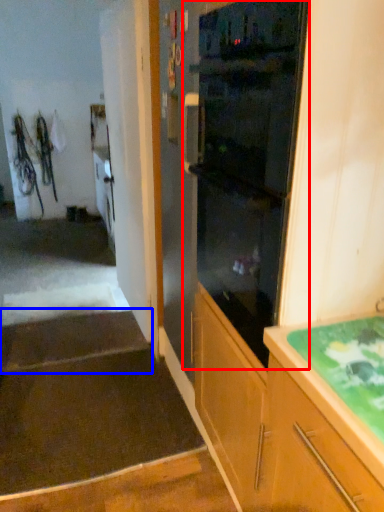
Question: Which of the following is the farthest to the observer, home appliance (highlighted by a red box) or stairwell (highlighted by a blue box)?

Choices:
 (A) home appliance
 (B) stairwell

Answer: (B)